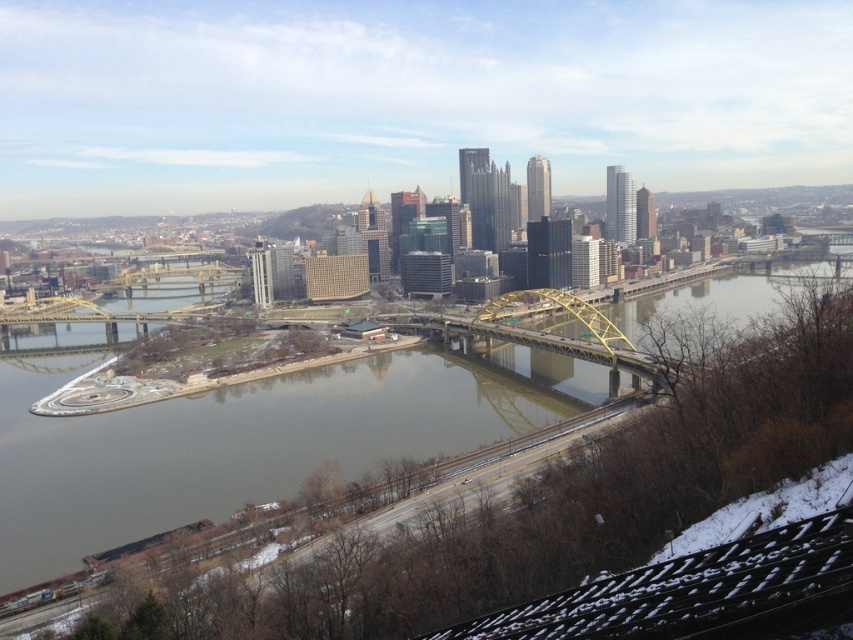
Question: In this image, where is greenish-gray water at center located relative to yellow metallic bridge at center?

Choices:
 (A) left
 (B) right

Answer: (B)

Question: Does greenish-gray water at center appear on the left side of yellow metallic bridge at center?

Choices:
 (A) yes
 (B) no

Answer: (B)

Question: Where is greenish-gray water at center located in relation to yellow metallic bridge at center in the image?

Choices:
 (A) right
 (B) left

Answer: (A)

Question: Which point is closer to the camera?

Choices:
 (A) (640, 326)
 (B) (534, 332)

Answer: (A)